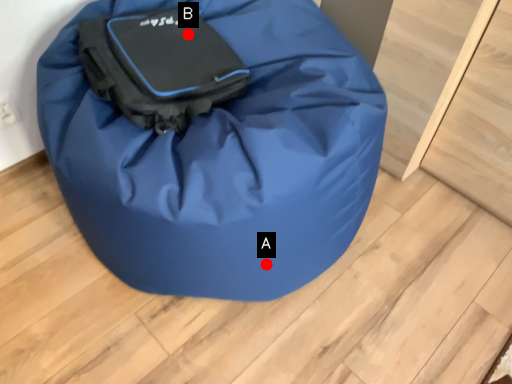
Question: Two points are circled on the image, labeled by A and B beside each circle. Which point is farther to the camera?

Choices:
 (A) A is further
 (B) B is further

Answer: (B)